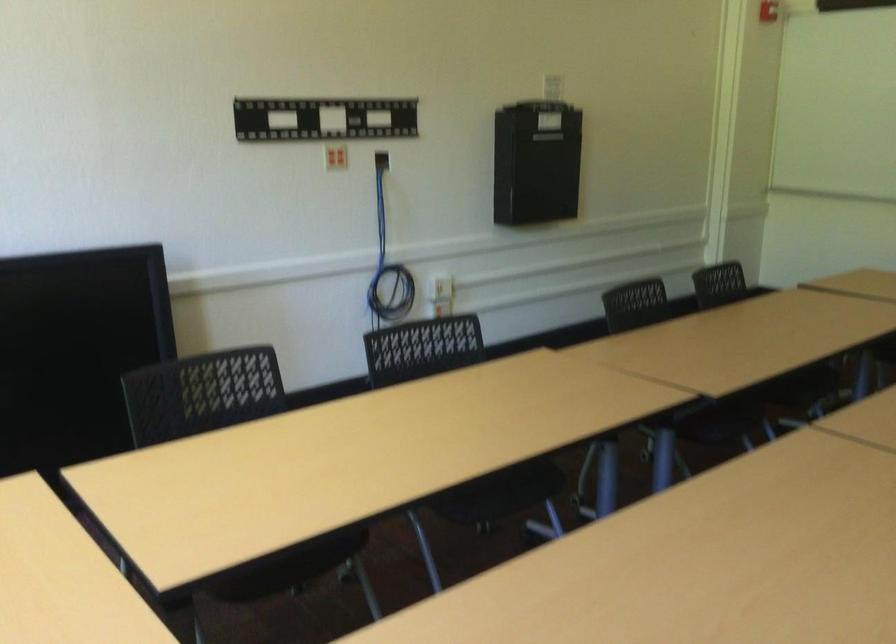
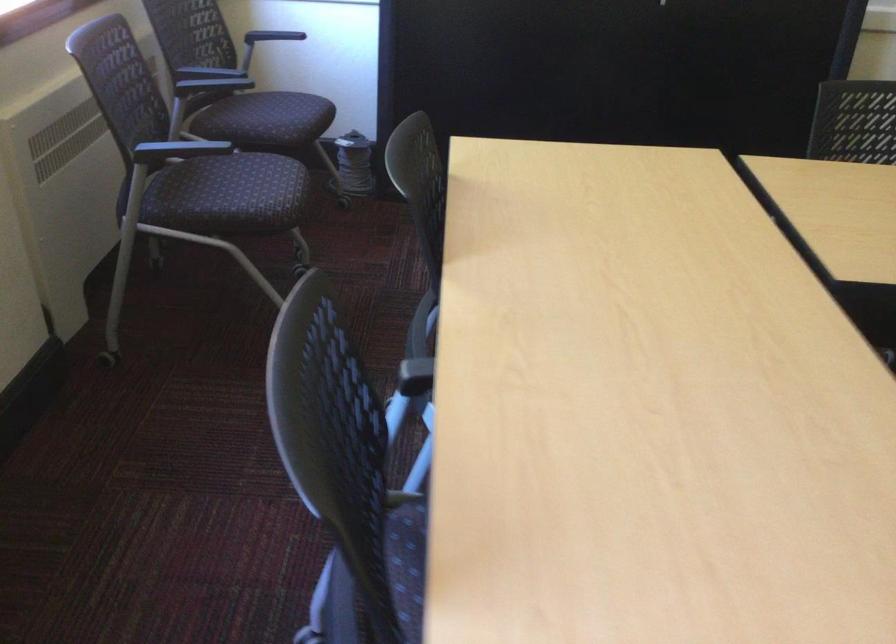
How did the camera likely rotate?

The camera's rotation is toward left-down.